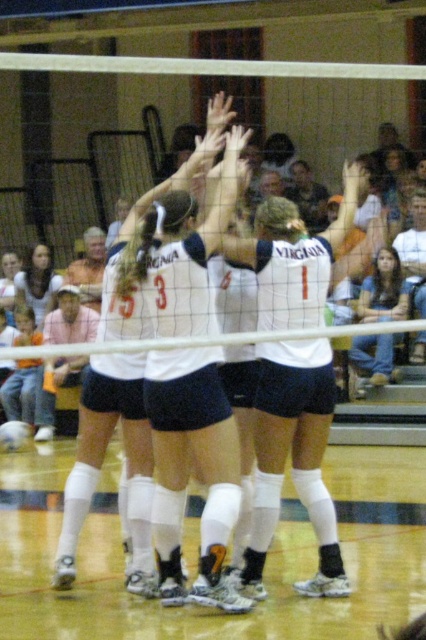
You are a photographer standing at the back of the gymnasium. You want to take a photo of the white matte jersey at center and the denim jeans at lower right. Which object should you zoom in on to capture more details?

The white matte jersey at center is bigger than denim jeans at lower right, so you should zoom in on the white matte jersey at center to capture more details.

You are a photographer standing at the back of the gymnasium and want to take a photo of the white matte volleyball net at center and the denim jeans at lower right. Which object should you adjust your camera to focus on first if you want to capture both in the same frame?

The white matte volleyball net at center is located below denim jeans at lower right, so you should focus on the denim jeans at lower right first to ensure both are in the frame.